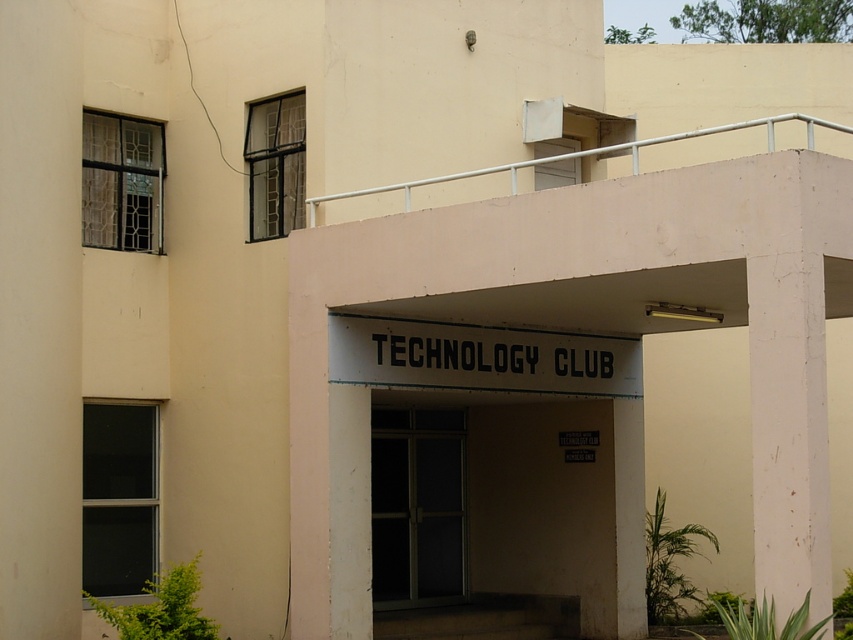
Question: Can you confirm if white painted concrete pillar at right is wider than transparent glass door at center?

Choices:
 (A) no
 (B) yes

Answer: (A)

Question: Is white painted concrete pillar at right to the right of transparent glass door at center from the viewer's perspective?

Choices:
 (A) no
 (B) yes

Answer: (B)

Question: Which object is closer to the camera taking this photo?

Choices:
 (A) white painted concrete pillar at right
 (B) transparent glass door at center

Answer: (A)

Question: Which point is closer to the camera?

Choices:
 (A) (751, 401)
 (B) (451, 492)

Answer: (A)

Question: Is white painted concrete pillar at right below transparent glass door at center?

Choices:
 (A) yes
 (B) no

Answer: (B)

Question: Which object appears closest to the camera in this image?

Choices:
 (A) transparent glass door at center
 (B) white painted concrete pillar at right

Answer: (B)